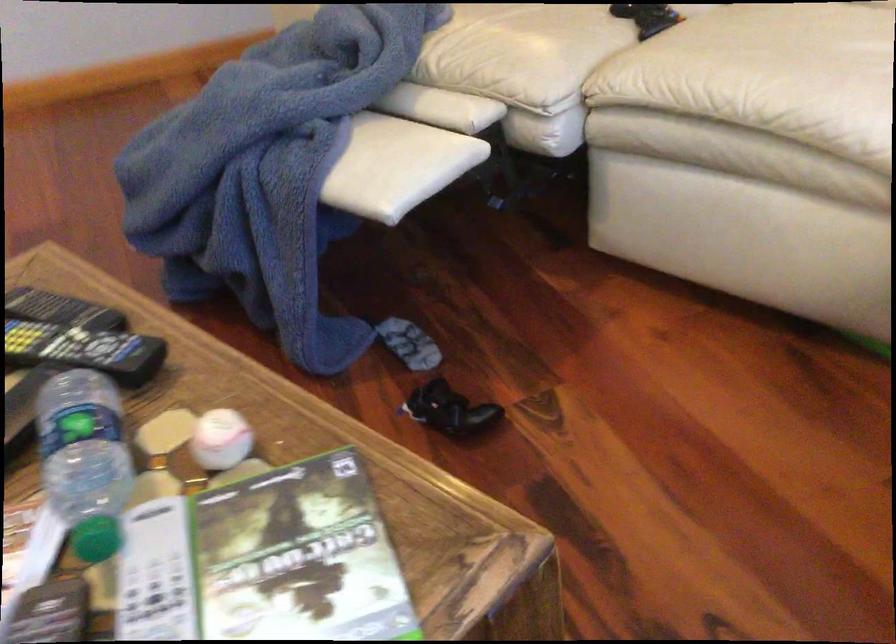
Find where to twist the green bottle cap. Please return your answer as a coordinate pair (x, y).

(96, 538)